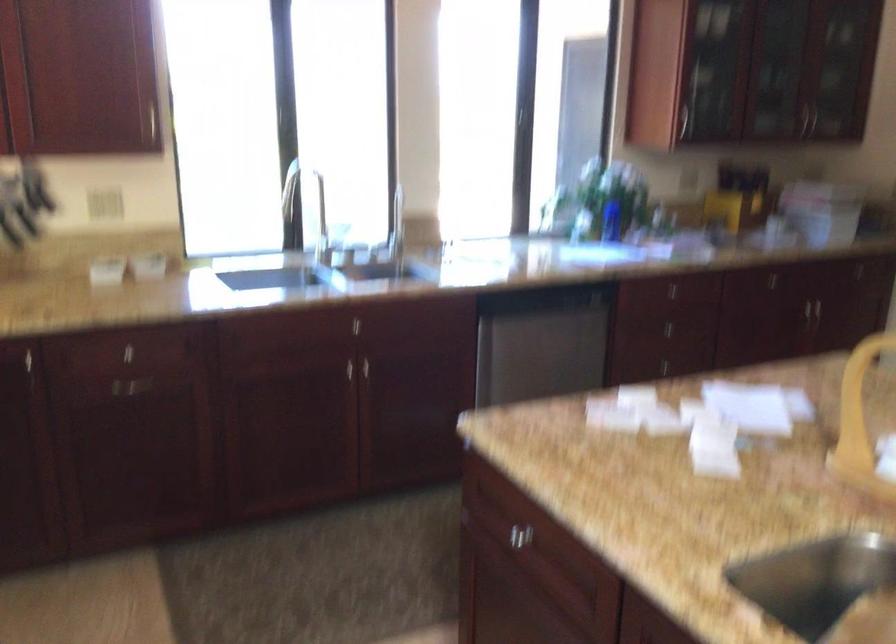
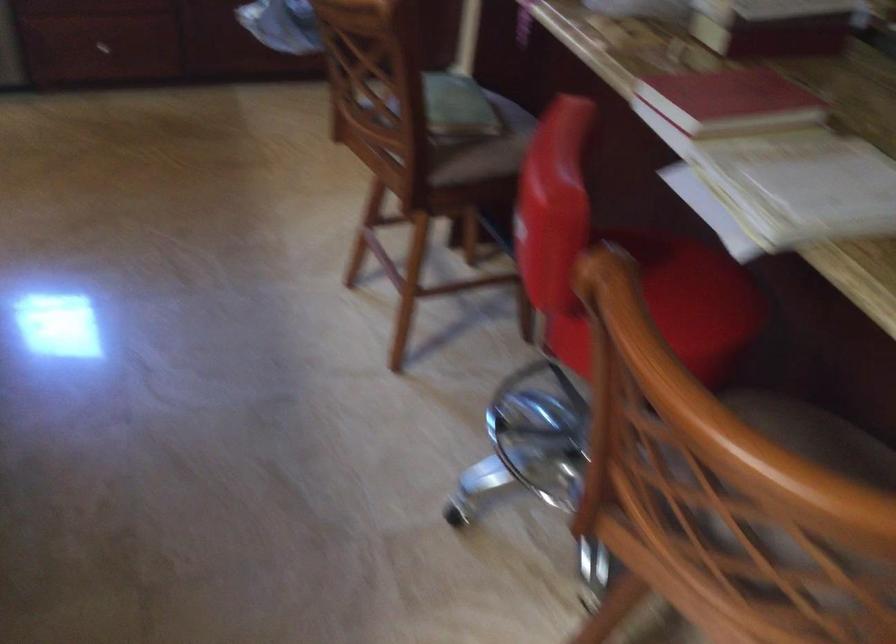
Question: Which direction would the cameraman need to move to produce the second image? Reply with the corresponding letter.

Choices:
 (A) Left
 (B) Right
 (C) Forward
 (D) Backward

Answer: (B)